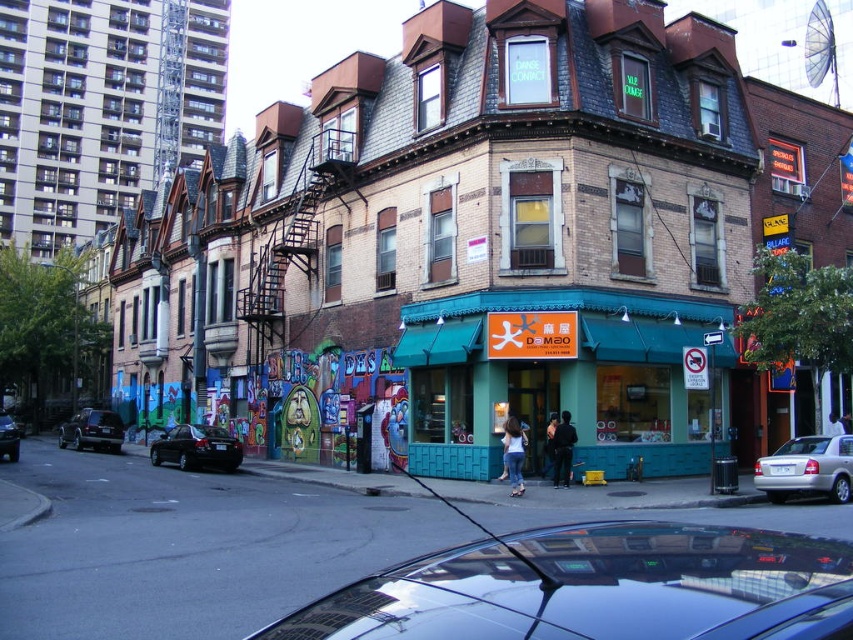
Does point (810, 460) come farther from viewer compared to point (515, 492)?

No, (810, 460) is in front of (515, 492).

Is silver metallic sedan at lower right closer to camera compared to denim jeans at center?

Yes, silver metallic sedan at lower right is in front of denim jeans at center.

The height and width of the screenshot is (640, 853). What do you see at coordinates (807, 468) in the screenshot?
I see `silver metallic sedan at lower right` at bounding box center [807, 468].

Find the location of a particular element. The height and width of the screenshot is (640, 853). silver metallic sedan at lower right is located at coordinates (807, 468).

Who is positioned more to the left, shiny black sedan at center or denim jeans at center?

shiny black sedan at center is more to the left.

Looking at this image, is shiny black sedan at center above denim jeans at center?

No.

Which is behind, point (207, 436) or point (519, 458)?

The point (207, 436) is behind.

You are a GUI agent. You are given a task and a screenshot of the screen. Output one action in this format:
    pyautogui.click(x=<x>, y=<y>)
    Task: Click on the shiny black sedan at center
    
    Given the screenshot: What is the action you would take?
    tap(196, 448)

Is point (564, 413) positioned after point (830, 429)?

No, it is in front of (830, 429).

The image size is (853, 640). Identify the location of black leather jacket at center. (561, 449).